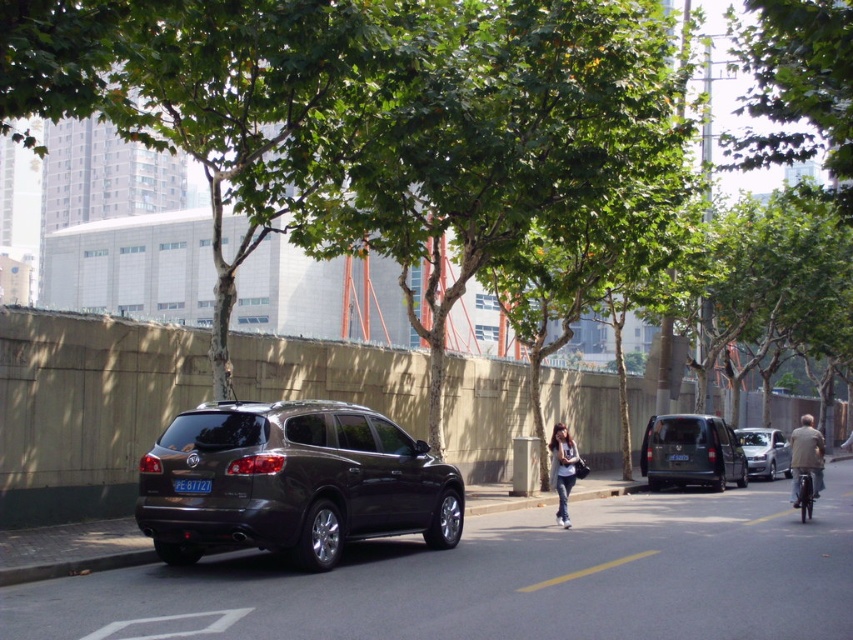
Question: Among these objects, which one is farthest from the camera?

Choices:
 (A) matte gray van at right
 (B) black plastic license plate at center
 (C) denim jeans at center

Answer: (A)

Question: Which is nearer to the dark gray matte minivan at center?

Choices:
 (A) denim jeans at center
 (B) satin dark gray minivan at center
 (C) metallic silver bicycle at right

Answer: (C)

Question: Is brown leather jacket at right below metallic silver bicycle at right?

Choices:
 (A) no
 (B) yes

Answer: (B)

Question: Is metallic silver bicycle at right further to the viewer compared to black plastic license plate at center?

Choices:
 (A) no
 (B) yes

Answer: (B)

Question: Does brown leather jacket at right have a smaller size compared to metallic silver bicycle at right?

Choices:
 (A) yes
 (B) no

Answer: (B)

Question: Estimate the real-world distances between objects in this image. Which object is farther from the metallic silver bicycle at right?

Choices:
 (A) dark gray matte minivan at center
 (B) satin dark gray minivan at center
 (C) black plastic license plate at center

Answer: (C)